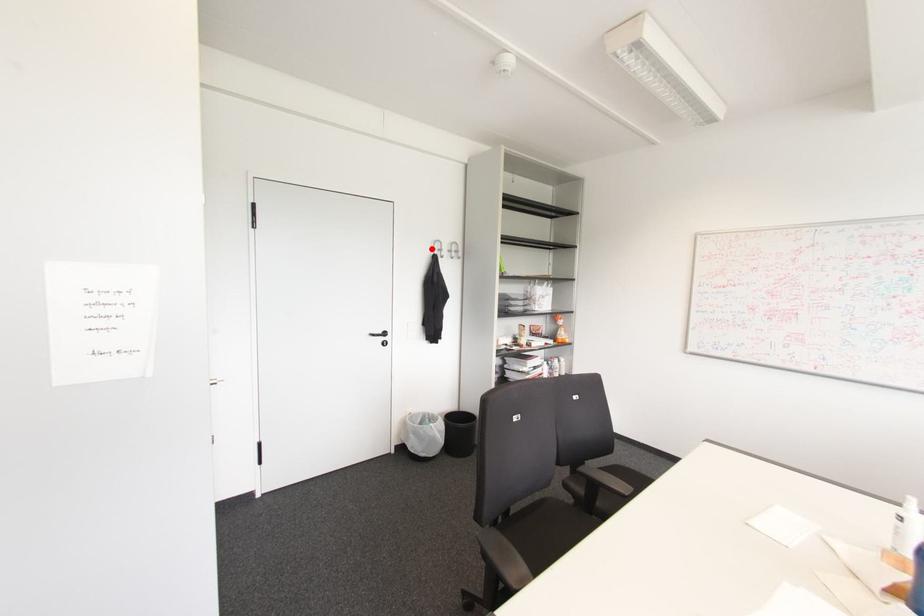
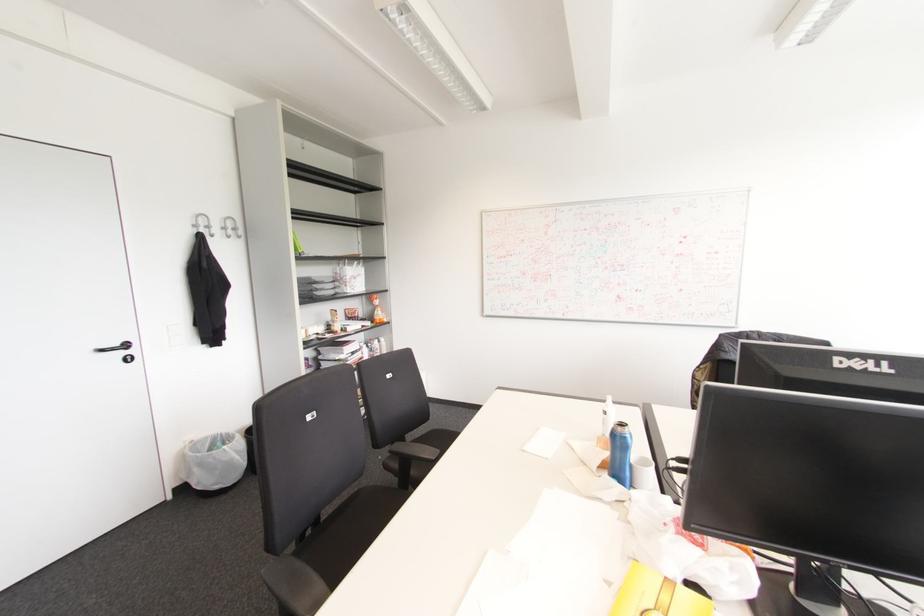
In the second image, find the point that corresponds to the highlighted location in the first image.

(195, 225)